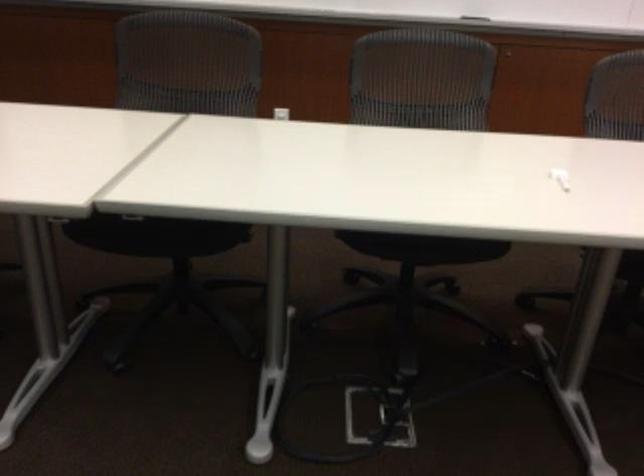
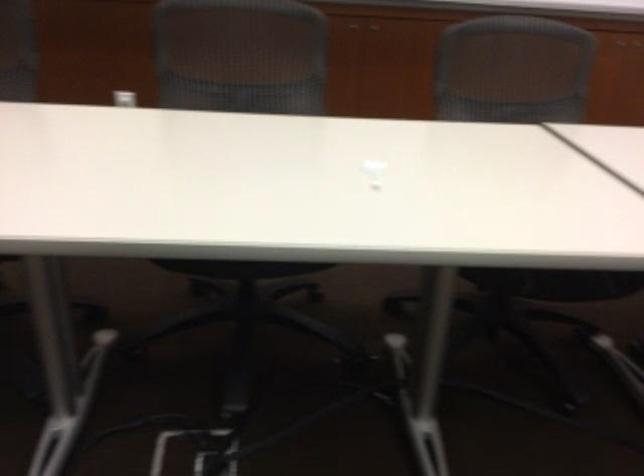
Find the pixel in the second image that matches (x=419, y=256) in the first image.

(239, 268)